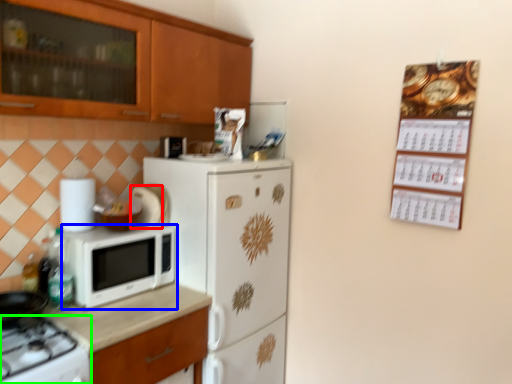
Question: Which is nearer to the appliance (highlighted by a red box)? microwave oven (highlighted by a blue box) or gas stove (highlighted by a green box).

Choices:
 (A) microwave oven
 (B) gas stove

Answer: (A)